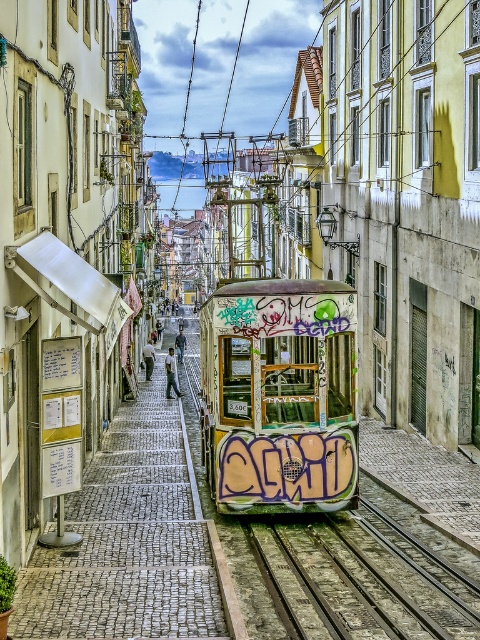
Who is positioned more to the right, white paper at center or graffiti-covered tram at center?

Positioned to the right is graffiti-covered tram at center.

Is white paper at center above graffiti-covered tram at center?

Actually, white paper at center is below graffiti-covered tram at center.

Who is more distant from viewer, (x=163, y=465) or (x=211, y=490)?

The point (x=163, y=465) is behind.

The width and height of the screenshot is (480, 640). In order to click on white paper at center in this screenshot , I will do `click(129, 540)`.

From the picture: Who is lower down, white paper at center or rusty metal train track at center?

rusty metal train track at center is below.

Is white paper at center smaller than rusty metal train track at center?

Actually, white paper at center might be larger than rusty metal train track at center.

Which is behind, point (158, 387) or point (276, 529)?

The point (158, 387) is behind.

This screenshot has width=480, height=640. What are the coordinates of `white paper at center` in the screenshot? It's located at (129, 540).

Can you confirm if graffiti-covered tram at center is bigger than rusty metal train track at center?

Indeed, graffiti-covered tram at center has a larger size compared to rusty metal train track at center.

Who is more forward, (261, 294) or (322, 605)?

Point (322, 605)

Identify the location of graffiti-covered tram at center. (279, 396).